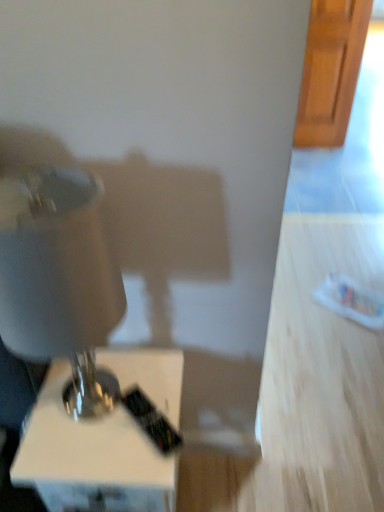
Question: From a real-world perspective, is white glossy lamp at lower left positioned under white glossy sewing machine at left based on gravity?

Choices:
 (A) no
 (B) yes

Answer: (B)

Question: Can you confirm if white glossy lamp at lower left is positioned to the left of white glossy sewing machine at left?

Choices:
 (A) no
 (B) yes

Answer: (A)

Question: Is the position of white glossy lamp at lower left less distant than that of white glossy sewing machine at left?

Choices:
 (A) no
 (B) yes

Answer: (A)

Question: Does white glossy lamp at lower left lie behind white glossy sewing machine at left?

Choices:
 (A) yes
 (B) no

Answer: (A)

Question: From the image's perspective, is white glossy lamp at lower left over white glossy sewing machine at left?

Choices:
 (A) yes
 (B) no

Answer: (B)

Question: Can you confirm if white glossy lamp at lower left is wider than white glossy sewing machine at left?

Choices:
 (A) no
 (B) yes

Answer: (B)

Question: From a real-world perspective, does white glossy sewing machine at left stand above white glossy lamp at lower left?

Choices:
 (A) no
 (B) yes

Answer: (B)

Question: Can you confirm if white glossy sewing machine at left is bigger than white glossy lamp at lower left?

Choices:
 (A) no
 (B) yes

Answer: (A)

Question: Is white glossy sewing machine at left taller than white glossy lamp at lower left?

Choices:
 (A) no
 (B) yes

Answer: (B)

Question: Is white glossy sewing machine at left outside white glossy lamp at lower left?

Choices:
 (A) no
 (B) yes

Answer: (B)

Question: Is white glossy lamp at lower left inside white glossy sewing machine at left?

Choices:
 (A) yes
 (B) no

Answer: (B)

Question: Can you confirm if white glossy sewing machine at left is smaller than white glossy lamp at lower left?

Choices:
 (A) no
 (B) yes

Answer: (B)

Question: From the image's perspective, is white glossy sewing machine at left above or below white glossy lamp at lower left?

Choices:
 (A) below
 (B) above

Answer: (B)